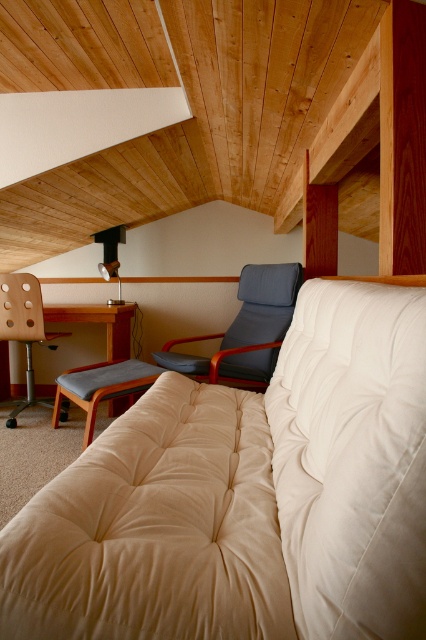
Question: Which point appears closest to the camera in this image?

Choices:
 (A) (112, 403)
 (B) (3, 316)
 (C) (75, 401)

Answer: (C)

Question: Which object appears closest to the camera in this image?

Choices:
 (A) beige fabric couch at center
 (B) matte wood armchair at left

Answer: (A)

Question: Which is nearer to the beige fabric couch at center?

Choices:
 (A) gray fabric stool at center
 (B) wooden desk at left

Answer: (A)

Question: Can you confirm if beige fabric couch at center is positioned below matte wood armchair at left?

Choices:
 (A) no
 (B) yes

Answer: (B)

Question: Is beige fabric couch at center to the right of wooden desk at left from the viewer's perspective?

Choices:
 (A) no
 (B) yes

Answer: (B)

Question: Observing the image, what is the correct spatial positioning of matte wood armchair at left in reference to wooden desk at left?

Choices:
 (A) above
 (B) below

Answer: (B)